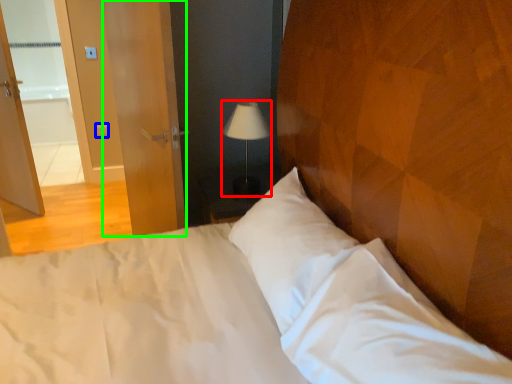
Question: Estimate the real-world distances between objects in this image. Which object is closer to lamp (highlighted by a red box), light switch (highlighted by a blue box) or screen door (highlighted by a green box)?

Choices:
 (A) light switch
 (B) screen door

Answer: (B)